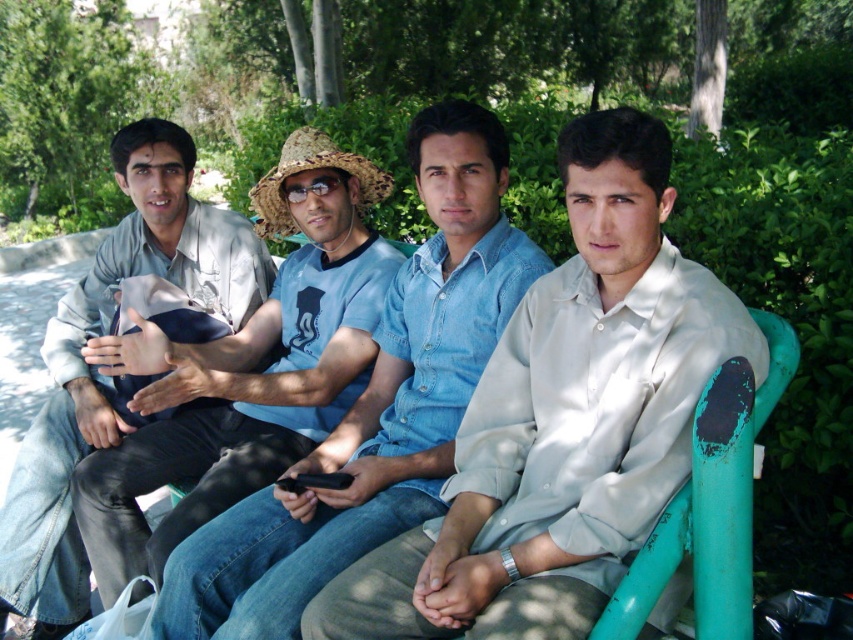
You are standing at the viewpoint of the image and want to walk towards the point at coordinates point (608,472). Will you pass by the point at coordinates point (408,378) first?

Yes, you will pass by the point at coordinates point (408,378) first because point (608,472) is located in front of it, meaning the path to point (608,472) would require passing through point (408,378) first.

You are standing in the park and see the image. The light blue denim shirt at center is represented by point (563, 420). If you want to find the light blue denim shirt at center, which direction should you look relative to the person on the far left?

The light blue denim shirt at center is located to the right of the person on the far left.